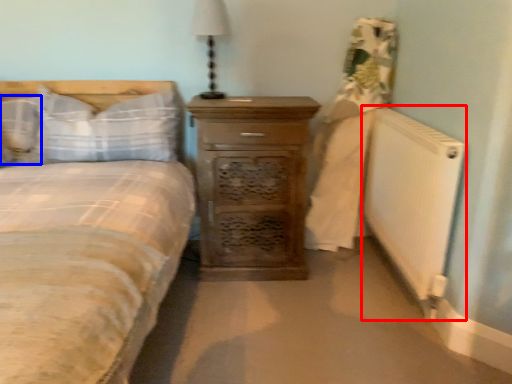
Question: Among these objects, which one is nearest to the camera, radiator (highlighted by a red box) or pillow (highlighted by a blue box)?

Choices:
 (A) radiator
 (B) pillow

Answer: (A)